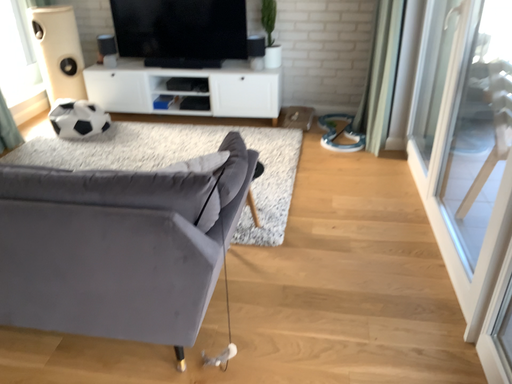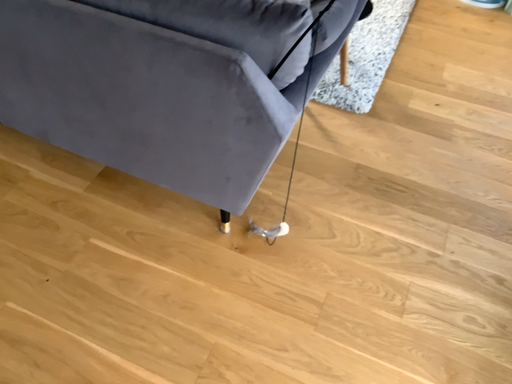
Question: Which way did the camera rotate in the video?

Choices:
 (A) rotated left
 (B) rotated right

Answer: (A)